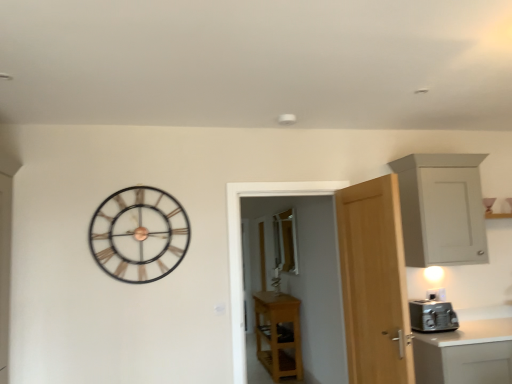
Locate an element on the screen. empty space that is ontop of metallic gold clock at upper left (from a real-world perspective) is located at coordinates (138, 182).